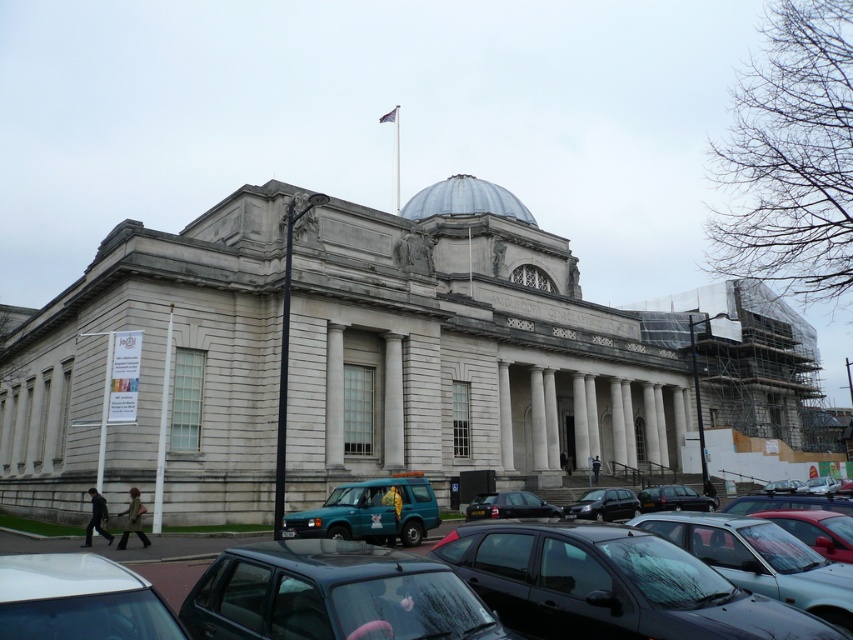
You are standing in front of the grand neoclassical building and notice two points marked on the ground. The first point is at coordinate point [221,596] and the second is at point [78,609]. Which point is closer to you as you face the building?

Point [221,596] is closer to you because it is further to the viewer than point [78,609].

You are standing at the point marked as point (370, 512) in the image. Looking towards the grand neoclassical building with the dome, which direction should you walk to reach the teal matte van at lower center?

The point (370, 512) corresponds to the teal matte van at lower center, so you are already at that location.

You are a tour guide explaining the parking lot layout to a visitor. You mention the black glossy car at center and the metallic blue van at lower right. Which vehicle is narrower?

The black glossy car at center is narrower than the metallic blue van at lower right.